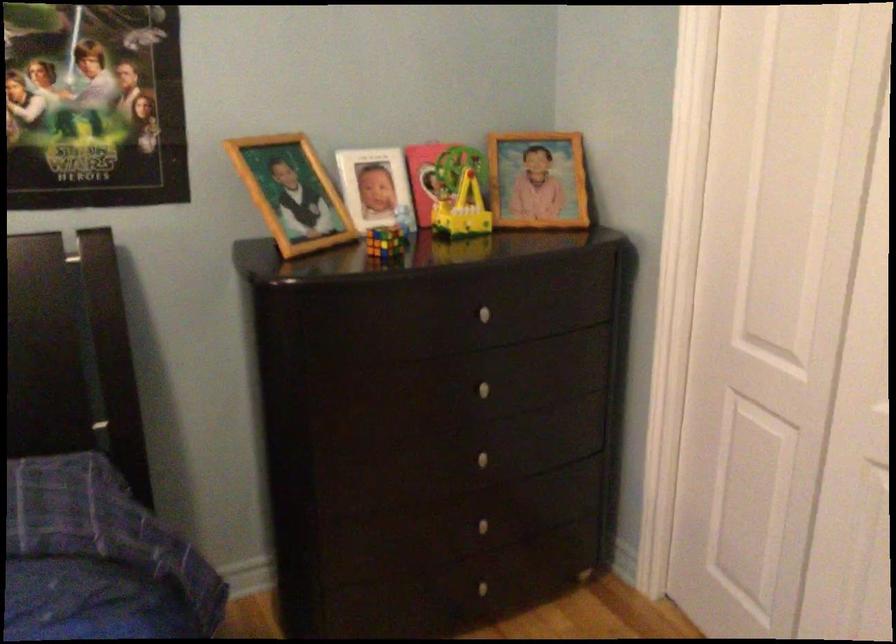
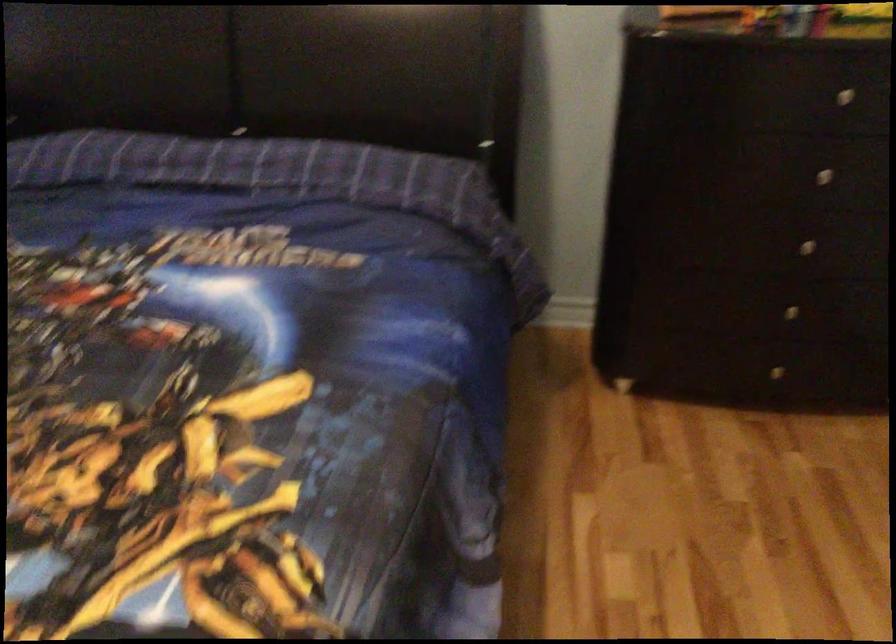
The point at (494, 379) is marked in the first image. Where is the corresponding point in the second image?

(833, 169)